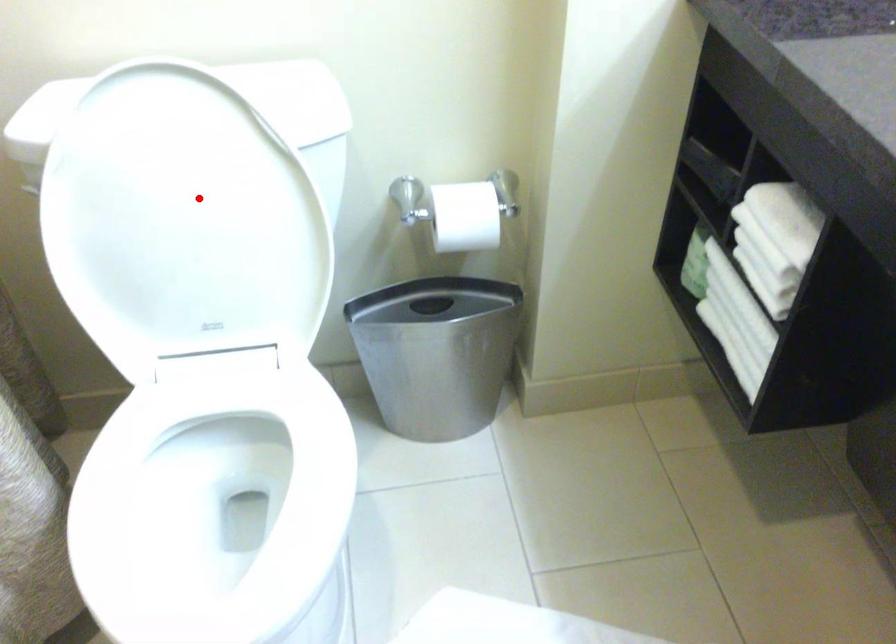
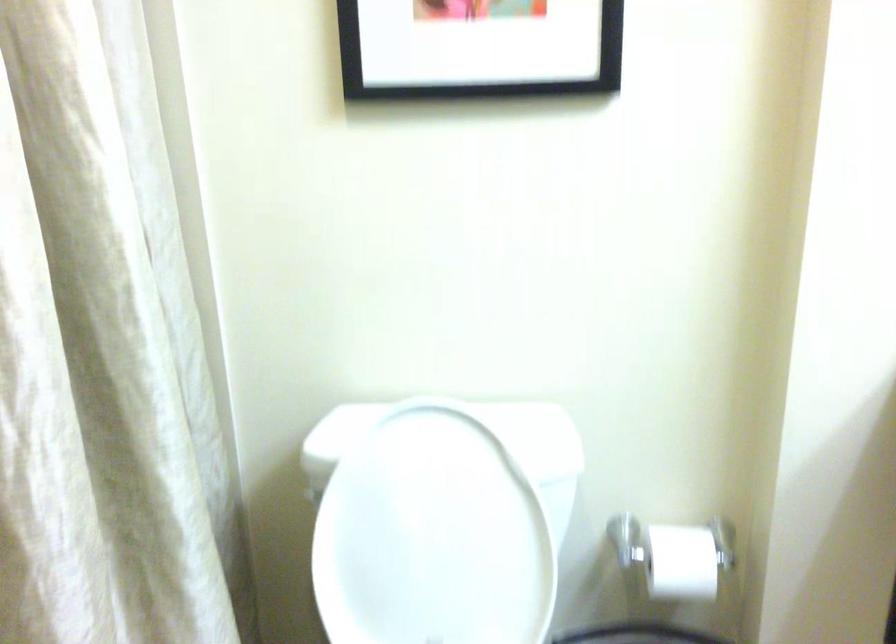
Question: I am providing you with two images of the same scene from different viewpoints. A red point is marked on the first image. Can you still see the location of the red point in image 2?

Choices:
 (A) Yes
 (B) No

Answer: (A)